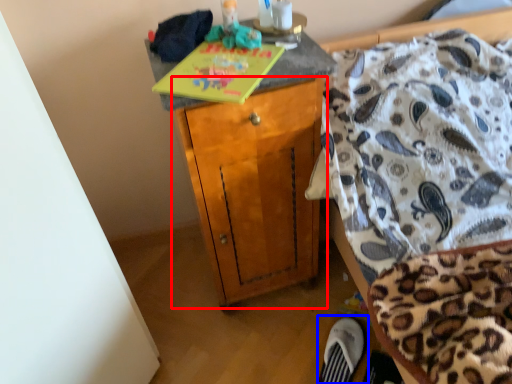
Question: Which point is further to the camera, cabinetry (highlighted by a red box) or footwear (highlighted by a blue box)?

Choices:
 (A) cabinetry
 (B) footwear

Answer: (B)